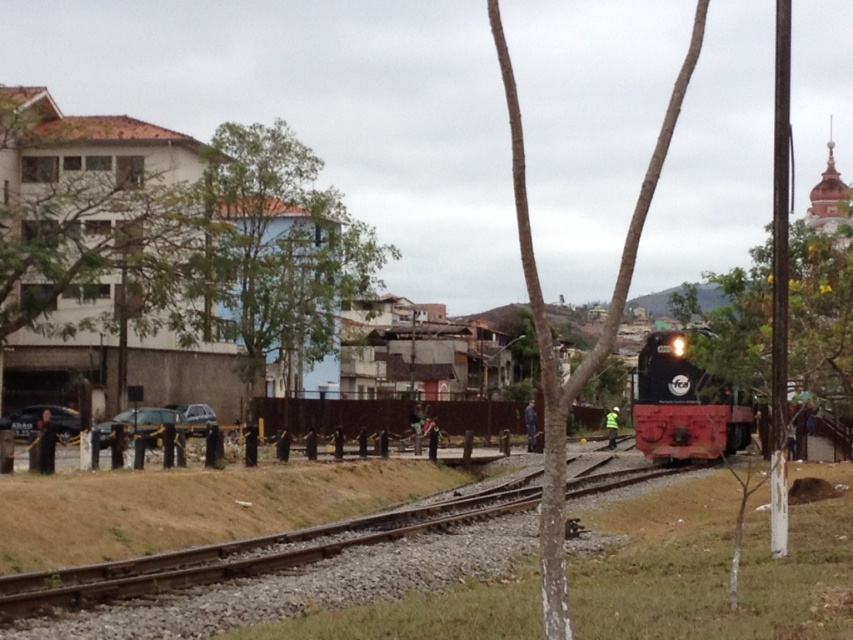
Consider the image. You are a bird flying over the urban railway scene. You see the green leafy tree at right and the smooth bark tree at center. Which tree should you land on if you want to perch on the taller one?

The smooth bark tree at center is taller than the green leafy tree at right, so you should land on the smooth bark tree at center.